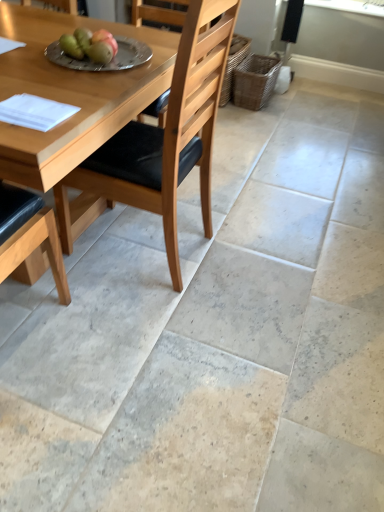
At what (x,y) coordinates should I click in order to perform the action: click on vacant point above white paper at lower left (from a real-world perspective). Please return your answer as a coordinate pair (x, y). Image resolution: width=384 pixels, height=512 pixels. Looking at the image, I should click on (36, 111).